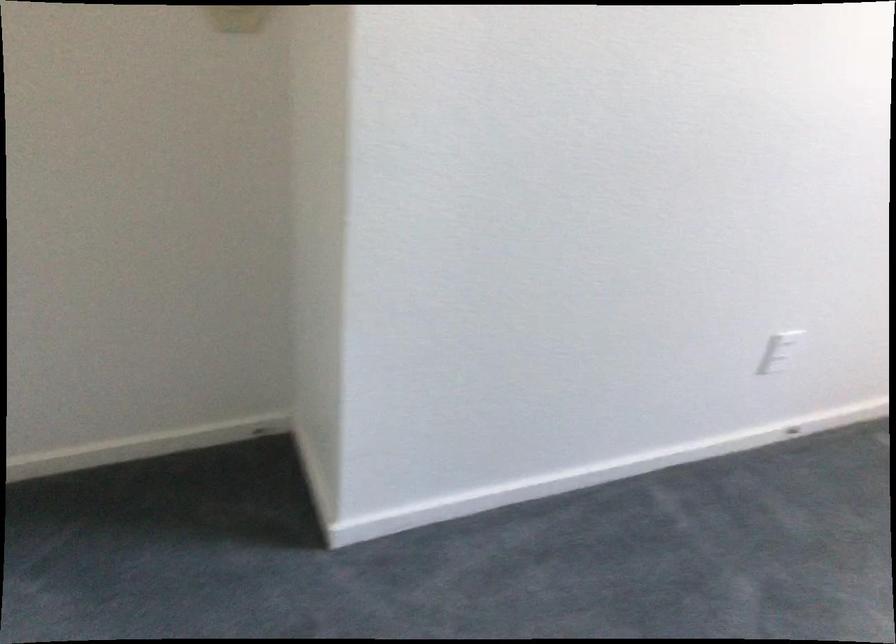
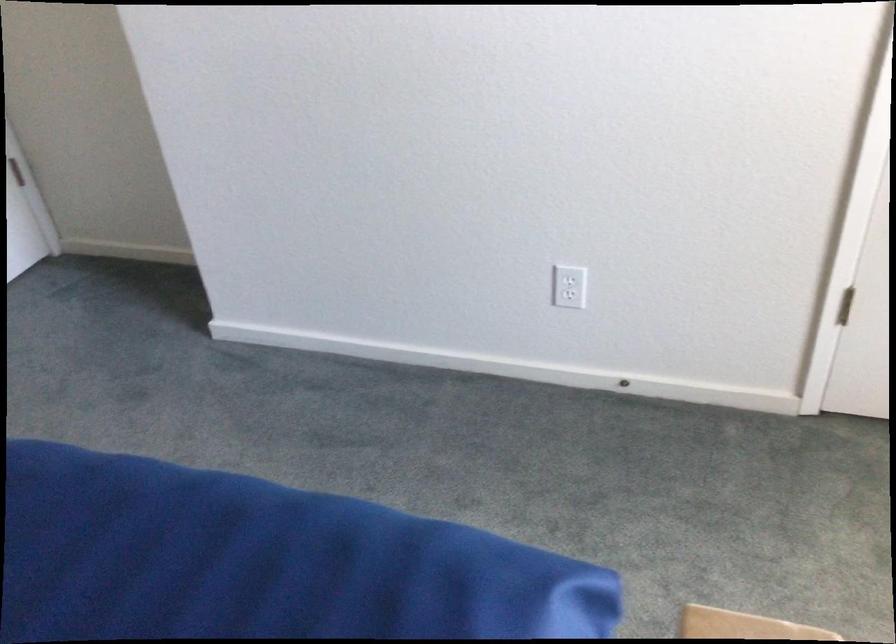
Find the pixel in the second image that matches (x=769, y=346) in the first image.

(570, 279)